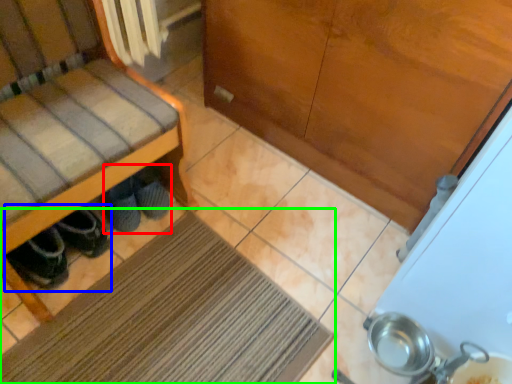
Question: Estimate the real-world distances between objects in this image. Which object is farther from footwear (highlighted by a red box), footwear (highlighted by a blue box) or mat (highlighted by a green box)?

Choices:
 (A) footwear
 (B) mat

Answer: (B)